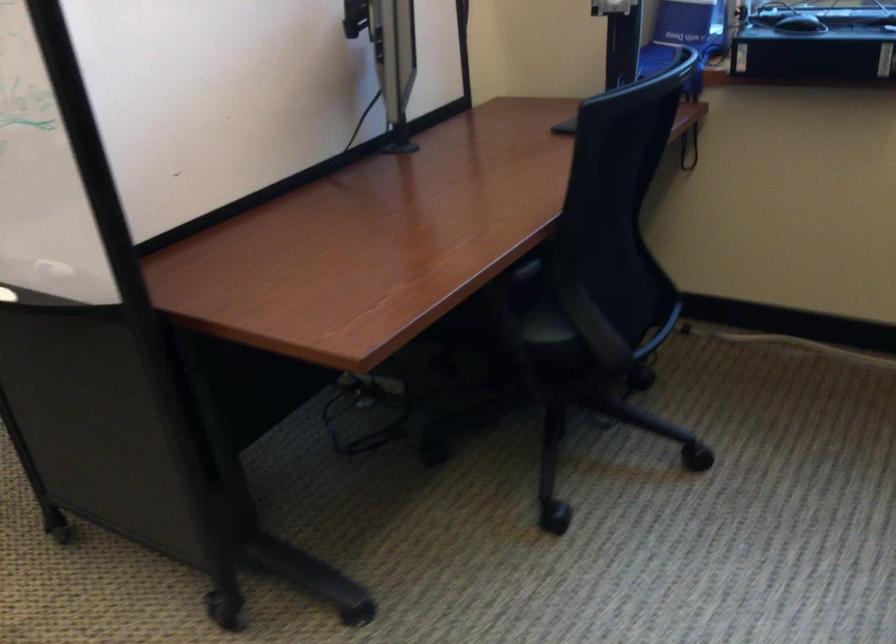
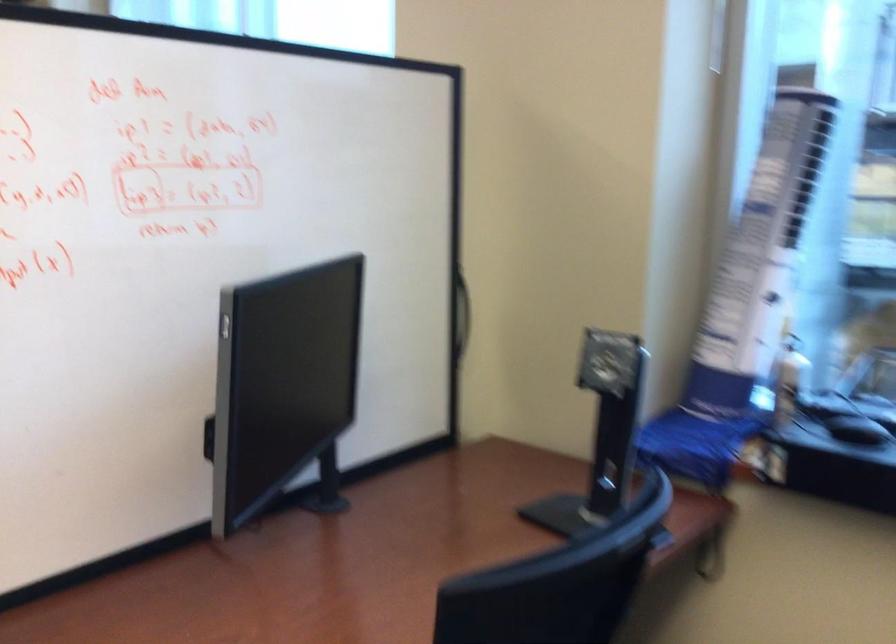
The images are taken continuously from a first-person perspective. In which direction are you moving?

The cameraman walked toward right, forward.